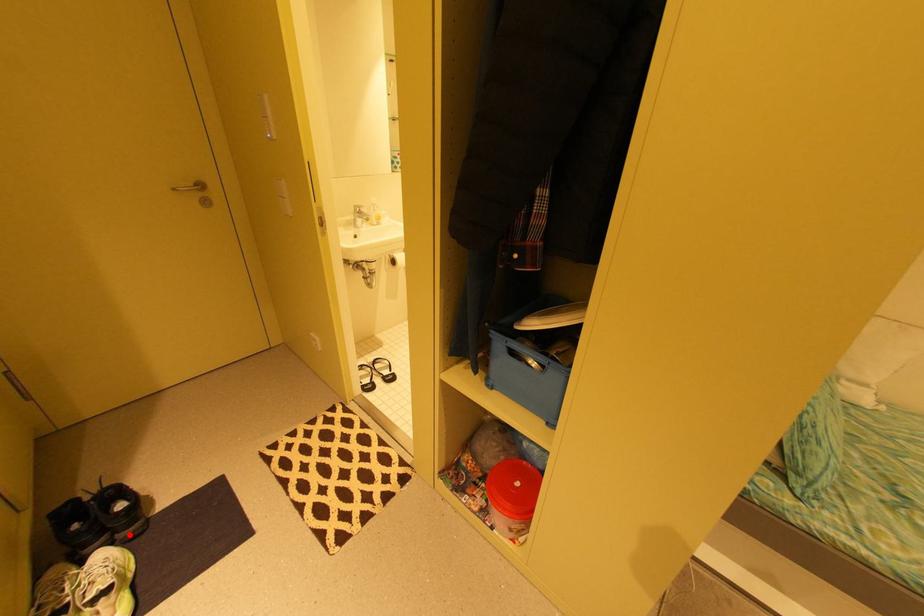
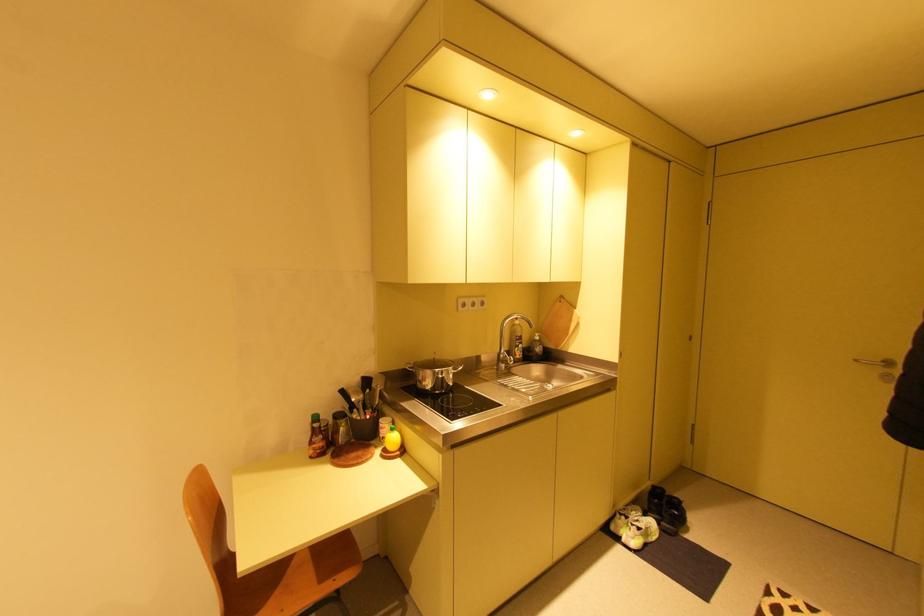
Question: I am providing you with two images of the same scene from different viewpoints. Image1 has a red point marked. In image2, the corresponding 3D location appears at what relative position? Reply with the corresponding letter.

Choices:
 (A) Closer
 (B) Farther

Answer: (A)